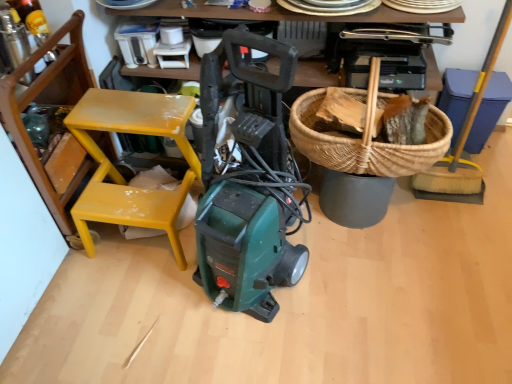
Question: Considering the relative sizes of yellow-bristled broom at right and woven brown basket at upper right in the image provided, is yellow-bristled broom at right taller than woven brown basket at upper right?

Choices:
 (A) no
 (B) yes

Answer: (B)

Question: Would you say woven brown basket at upper right is part of yellow-bristled broom at right's contents?

Choices:
 (A) no
 (B) yes

Answer: (A)

Question: Can you confirm if yellow-bristled broom at right is positioned to the right of woven brown basket at upper right?

Choices:
 (A) no
 (B) yes

Answer: (B)

Question: Is yellow-bristled broom at right positioned in front of woven brown basket at upper right?

Choices:
 (A) yes
 (B) no

Answer: (B)

Question: Is yellow-bristled broom at right placed right next to woven brown basket at upper right?

Choices:
 (A) yes
 (B) no

Answer: (B)

Question: In the image, is yellow painted wood chair at left positioned in front of or behind woven brown basket at upper right?

Choices:
 (A) front
 (B) behind

Answer: (A)

Question: Is yellow painted wood chair at left wider or thinner than woven brown basket at upper right?

Choices:
 (A) thin
 (B) wide

Answer: (B)

Question: From the image's perspective, is yellow painted wood chair at left above or below woven brown basket at upper right?

Choices:
 (A) above
 (B) below

Answer: (B)

Question: Do you think yellow painted wood chair at left is within woven brown basket at upper right, or outside of it?

Choices:
 (A) outside
 (B) inside

Answer: (A)

Question: Is woven brown basket at upper right in front of or behind yellow painted wood chair at left in the image?

Choices:
 (A) front
 (B) behind

Answer: (B)

Question: Is woven brown basket at upper right wider or thinner than yellow painted wood chair at left?

Choices:
 (A) wide
 (B) thin

Answer: (B)

Question: Is point (343, 137) positioned closer to the camera than point (166, 107)?

Choices:
 (A) closer
 (B) farther

Answer: (A)

Question: Would you say woven brown basket at upper right is inside or outside yellow painted wood chair at left?

Choices:
 (A) outside
 (B) inside

Answer: (A)

Question: Is yellow-bristled broom at right bigger or smaller than yellow painted wood chair at left?

Choices:
 (A) small
 (B) big

Answer: (A)

Question: Considering the positions of point (476, 91) and point (132, 221), is point (476, 91) closer or farther from the camera than point (132, 221)?

Choices:
 (A) closer
 (B) farther

Answer: (B)